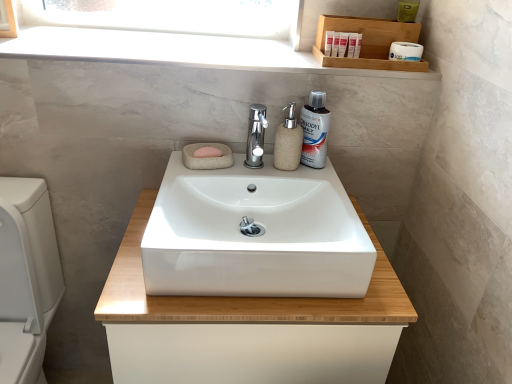
In order to click on vacant space situated above white marble window sill at upper center (from a real-world perspective) in this screenshot , I will do `click(180, 46)`.